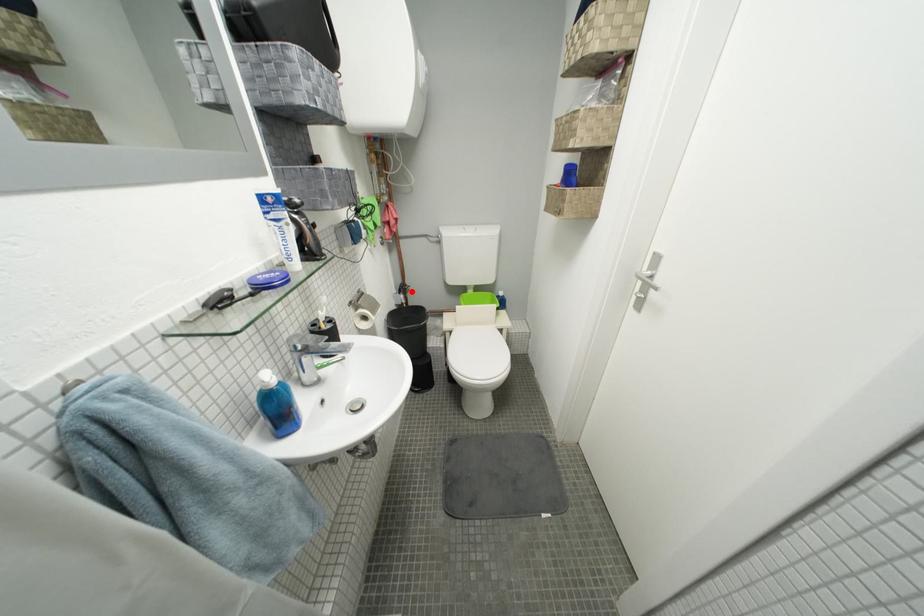
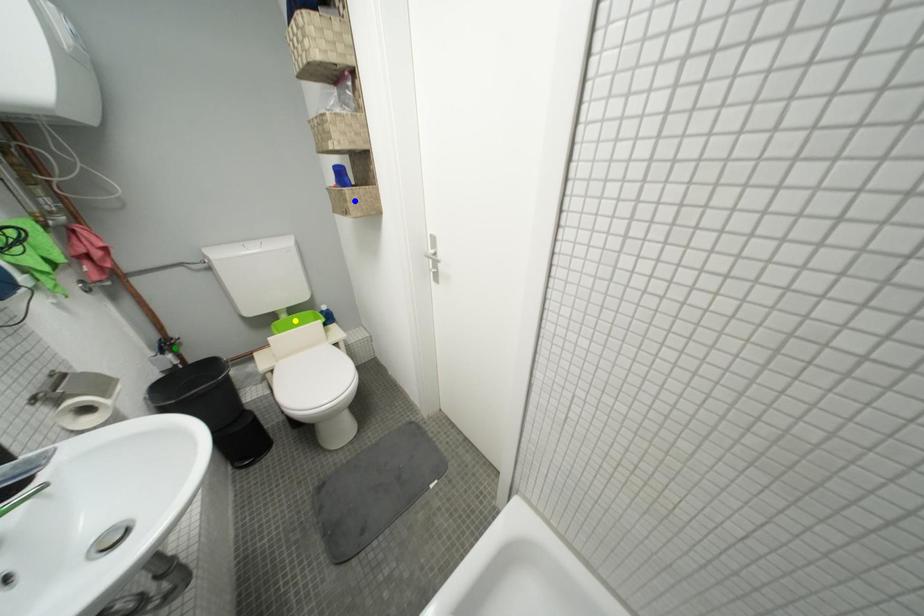
Question: I am providing you with two images of the same scene from different viewpoints. A red point is marked on the first image. You are given multiple points on the second image. Which mark in image 2 goes with the point in image 1?

Choices:
 (A) blue point
 (B) yellow point
 (C) green point

Answer: (C)